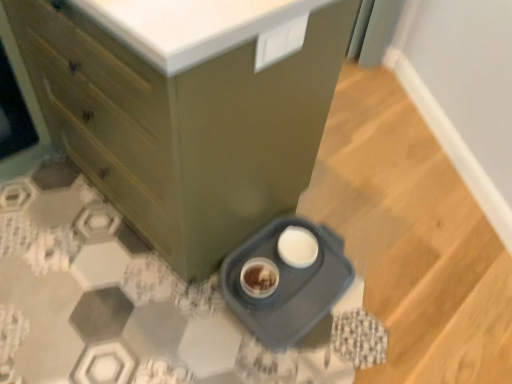
You are a GUI agent. You are given a task and a screenshot of the screen. Output one action in this format:
    pyautogui.click(x=<x>, y=<y>)
    Task: Click on the free point in front of gray plastic tray at lower center
    
    Given the screenshot: What is the action you would take?
    pyautogui.click(x=285, y=357)